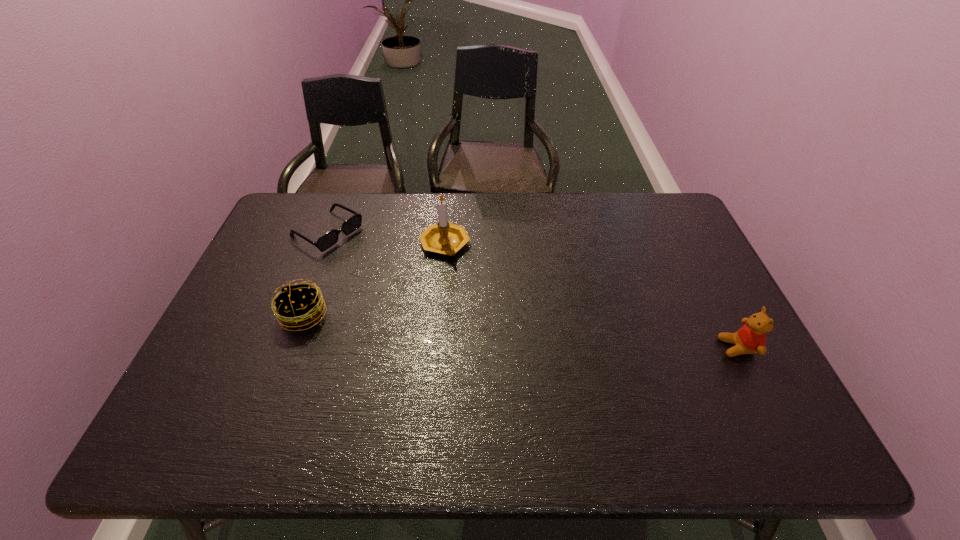
Locate an element on the screen. Image resolution: width=960 pixels, height=540 pixels. object that is at the right edge is located at coordinates (751, 338).

Find the location of a particular element. The image size is (960, 540). object at the far left corner is located at coordinates (329, 239).

The width and height of the screenshot is (960, 540). I want to click on free space at the far edge, so click(x=636, y=235).

At what (x,y) coordinates should I click in order to perform the action: click on free space at the near edge. Please return your answer as a coordinate pair (x, y). Image resolution: width=960 pixels, height=540 pixels. Looking at the image, I should click on (534, 390).

Identify the location of free space at the left edge of the desktop. (232, 316).

Image resolution: width=960 pixels, height=540 pixels. In the image, there is a desktop. In order to click on vacant space at the right edge in this screenshot , I will do `click(730, 321)`.

This screenshot has width=960, height=540. In order to click on free space at the far left corner in this screenshot , I will do `click(289, 194)`.

Find the location of a particular element. blank area at the near left corner is located at coordinates (200, 408).

Locate an element on the screen. empty location between the second shortest object and the tallest object is located at coordinates (374, 280).

This screenshot has width=960, height=540. Identify the location of empty space between the third tallest object and the third object from left to right. (374, 280).